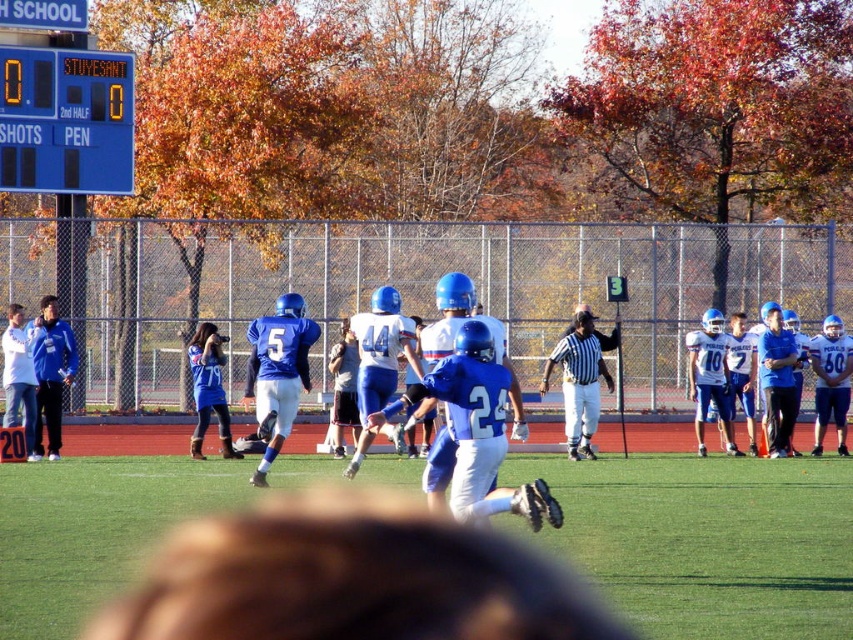
From the picture: Is green grass football field at center smaller than blue plastic scoreboard at upper left?

Actually, green grass football field at center might be larger than blue plastic scoreboard at upper left.

Measure the distance between point (67, 499) and camera.

The distance of point (67, 499) from camera is 53.42 feet.

Locate an element on the screen. This screenshot has height=640, width=853. green grass football field at center is located at coordinates (706, 540).

What do you see at coordinates (706, 540) in the screenshot?
I see `green grass football field at center` at bounding box center [706, 540].

Between point (728, 563) and point (770, 339), which one is positioned in front?

Point (728, 563) is in front.

The image size is (853, 640). I want to click on green grass football field at center, so click(706, 540).

Consider the image. Is blue plastic scoreboard at upper left further to camera compared to blue matte uniform at right?

Yes, blue plastic scoreboard at upper left is behind blue matte uniform at right.

Who is positioned more to the right, blue plastic scoreboard at upper left or blue matte uniform at right?

Positioned to the right is blue matte uniform at right.

Which is in front, point (74, 125) or point (844, 444)?

Point (844, 444) is more forward.

This screenshot has width=853, height=640. What are the coordinates of `blue plastic scoreboard at upper left` in the screenshot? It's located at (65, 120).